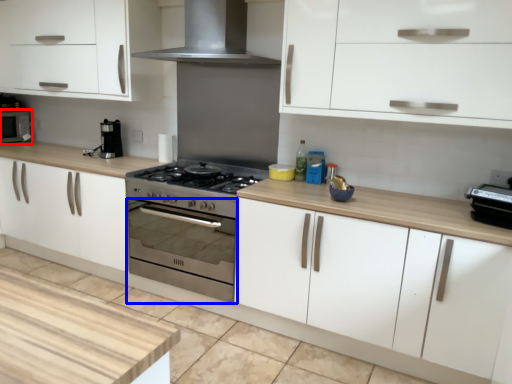
Question: Which object is closer to the camera taking this photo, microwave (highlighted by a red box) or oven (highlighted by a blue box)?

Choices:
 (A) microwave
 (B) oven

Answer: (B)